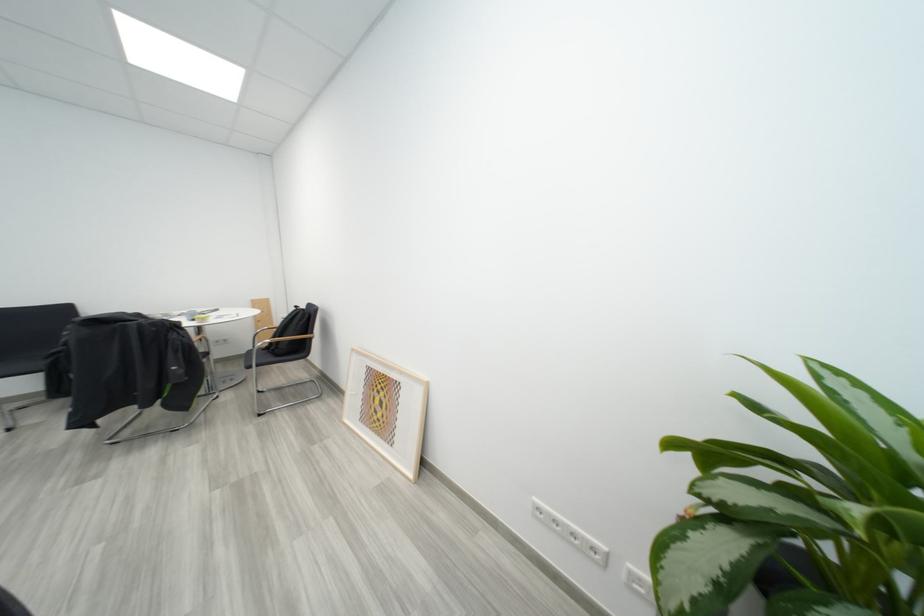
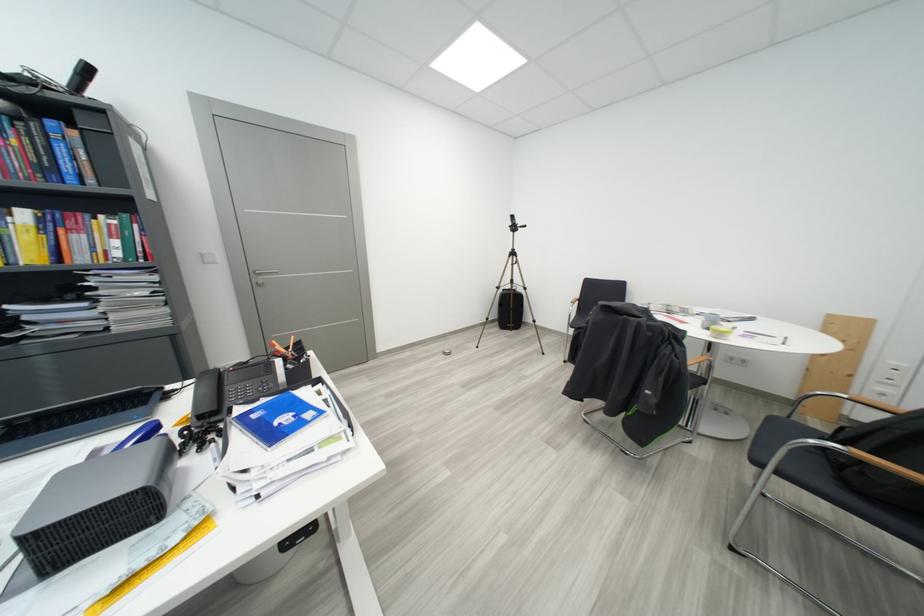
Where in the second image is the point corresponding to pixel 286 358 from the first image?

(856, 487)